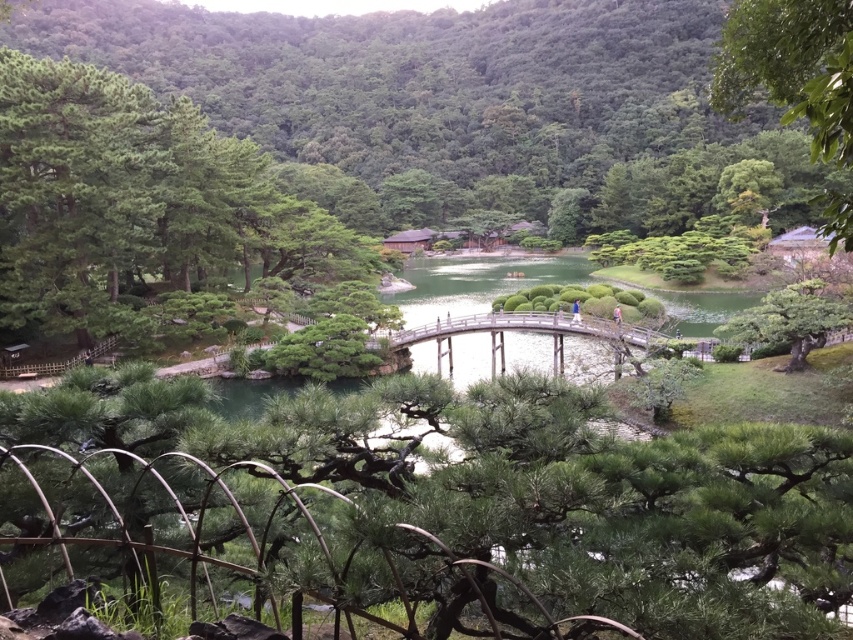
You are a visitor in the Japanese garden and want to take a photo of both the green leafy tree at upper right and the wooden bridge at center. Which object should you focus on first to ensure both are in frame?

You should focus on the wooden bridge at center first because the green leafy tree at upper right is much taller, so adjusting the camera angle to include its height while capturing the bridge might require a wider shot.

You are a visitor in the Japanese garden and want to take a photo of both the green textured pine tree at left and the green leafy tree at upper right. However, you notice that one of them is partially hidden. Which tree is blocking the view of the other?

The green leafy tree at upper right is behind the green textured pine tree at left, so the green textured pine tree at left is blocking the view of the green leafy tree at upper right.

You are a visitor in the Japanese garden and want to take a photo that includes both the green textured pine tree at left and the green leafy tree at upper right. Which tree should you move closer to in order to fit both into the frame?

Since the green textured pine tree at left occupies less space than the green leafy tree at upper right, you should move closer to the green leafy tree at upper right to ensure both trees fit into the frame.